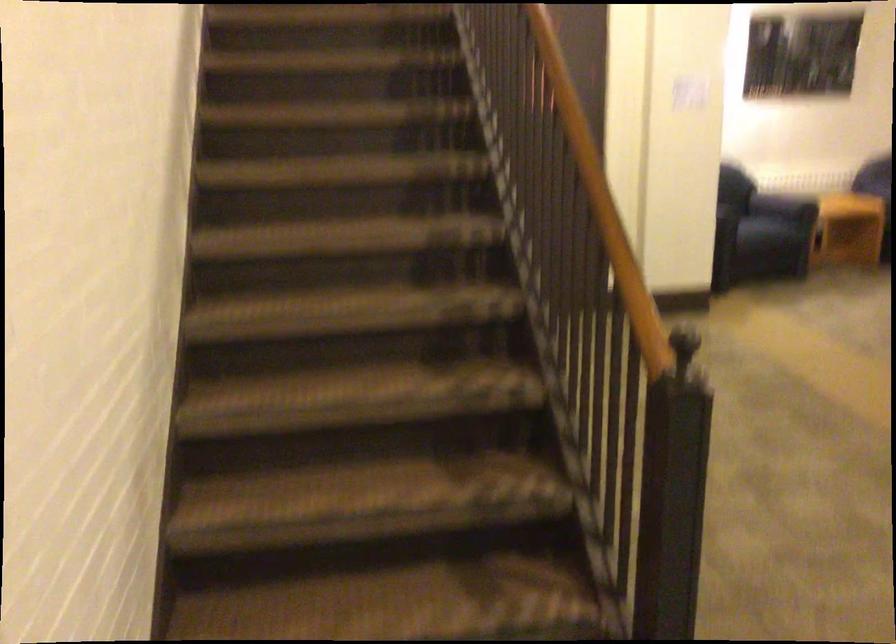
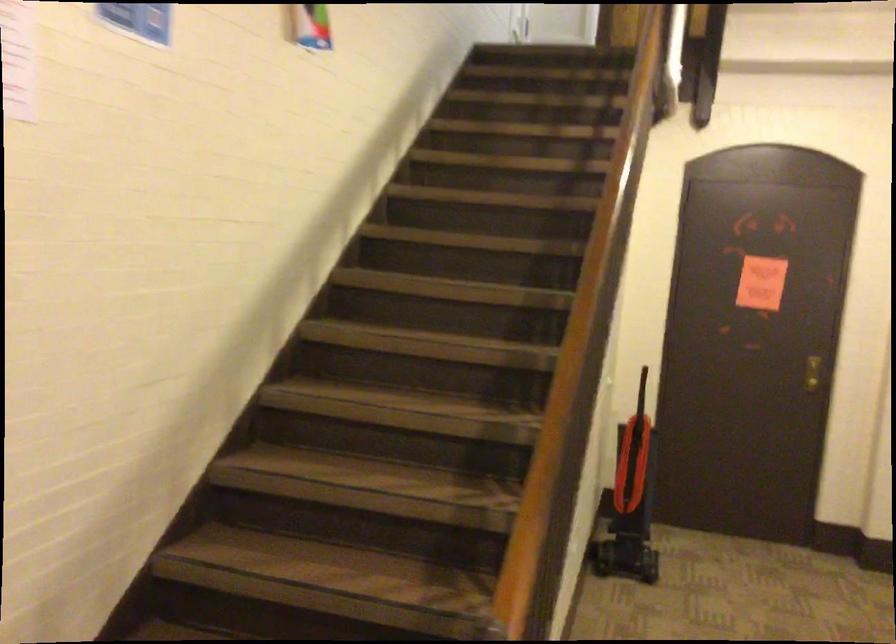
What movement of the cameraman would produce the second image?

The movement direction of the cameraman is right, forward.